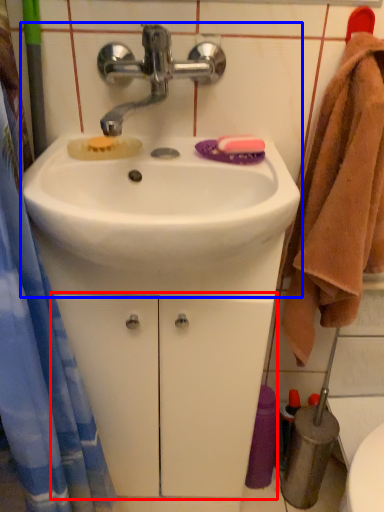
Question: Which object appears closest to the camera in this image, drawer (highlighted by a red box) or sink (highlighted by a blue box)?

Choices:
 (A) drawer
 (B) sink

Answer: (B)